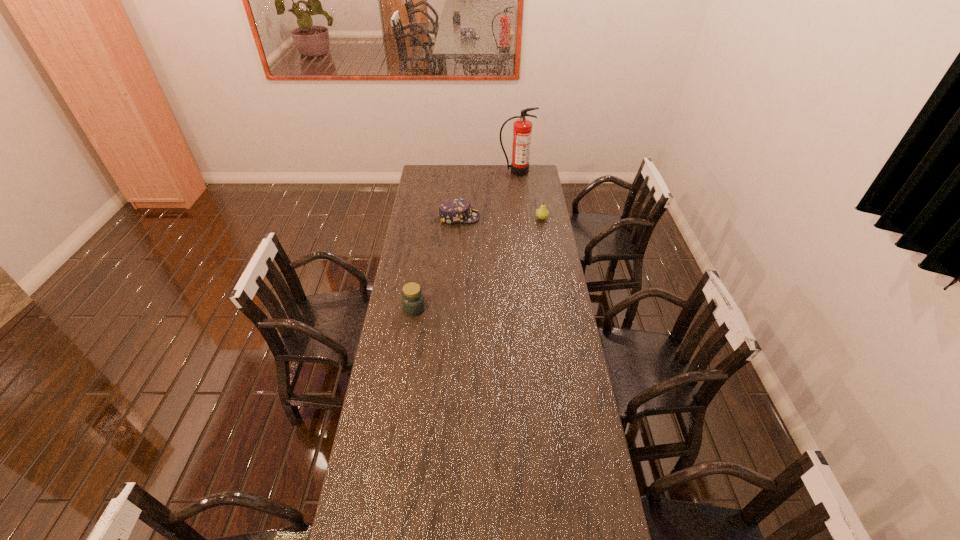
Where is `object that ranks as the second closest to the pear`? This screenshot has height=540, width=960. object that ranks as the second closest to the pear is located at coordinates (522, 128).

This screenshot has width=960, height=540. Find the location of `vacant area in the image that satisfies the following two spatial constraints: 1. on the front-facing side of the farthest object; 2. on the right side of the pear`. vacant area in the image that satisfies the following two spatial constraints: 1. on the front-facing side of the farthest object; 2. on the right side of the pear is located at coordinates (521, 219).

At what (x,y) coordinates should I click in order to perform the action: click on free space that satisfies the following two spatial constraints: 1. on the front-facing side of the third object from right to left; 2. on the left side of the pear. Please return your answer as a coordinate pair (x, y). The height and width of the screenshot is (540, 960). Looking at the image, I should click on (459, 219).